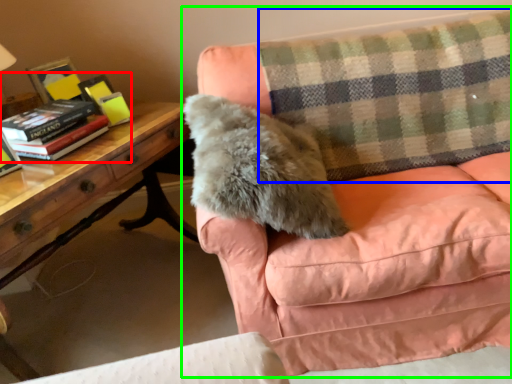
Question: Which is farther away from book (highlighted by a red box)? plaid (highlighted by a blue box) or studio couch (highlighted by a green box)?

Choices:
 (A) plaid
 (B) studio couch

Answer: (A)